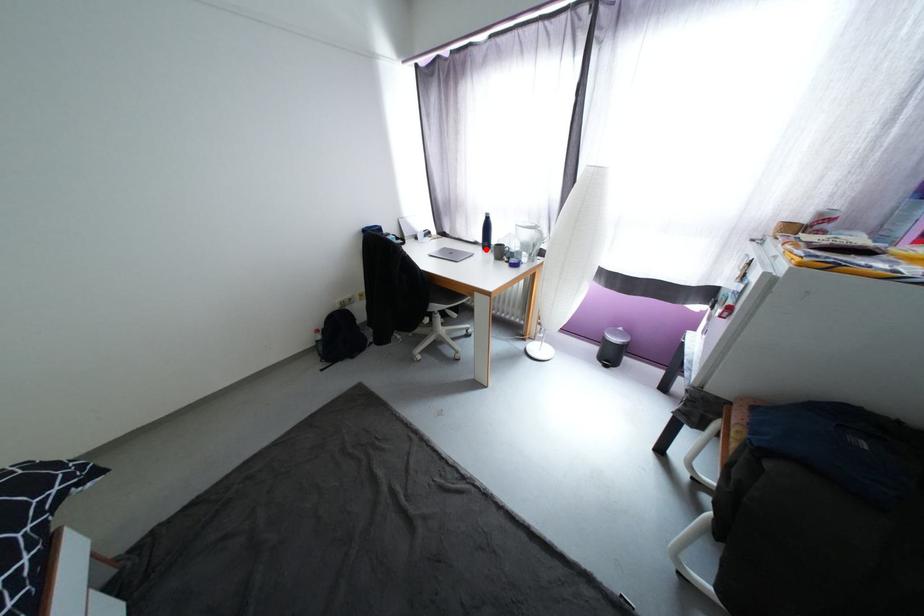
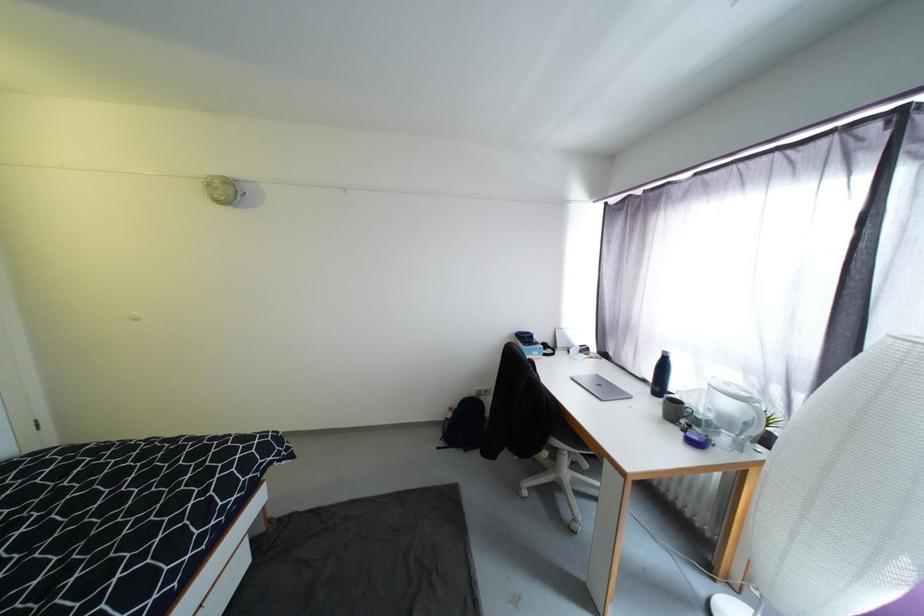
The point at the highlighted location is marked in the first image. Where is the corresponding point in the second image?

(654, 392)